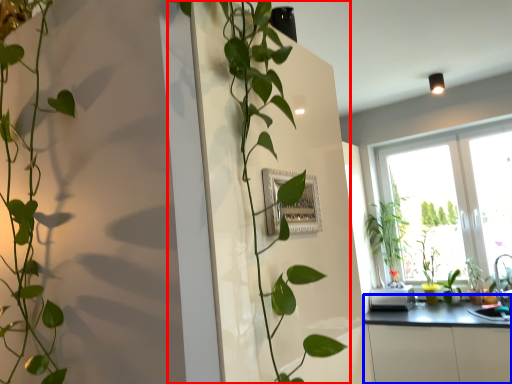
Question: Which point is further to the camera, houseplant (highlighted by a red box) or counter top (highlighted by a blue box)?

Choices:
 (A) houseplant
 (B) counter top

Answer: (B)